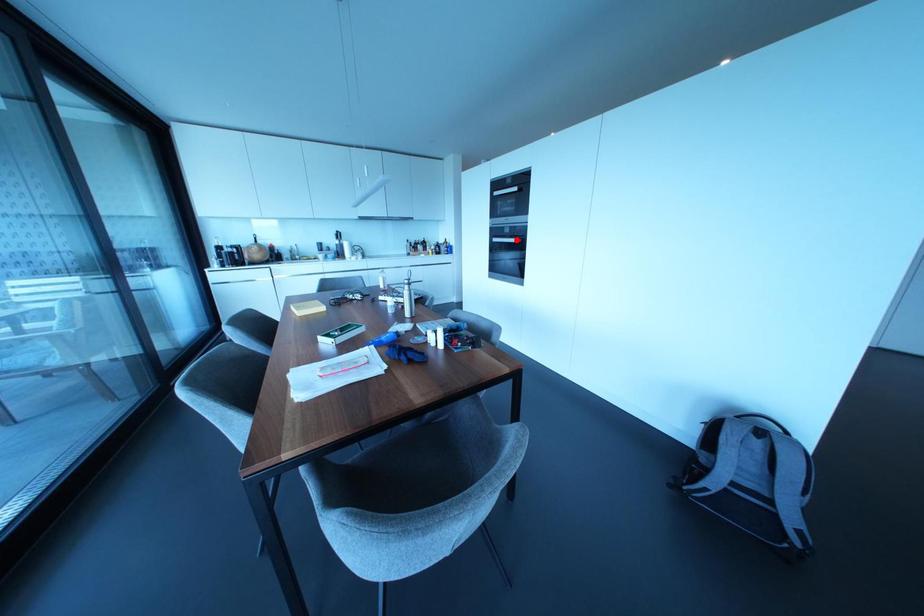
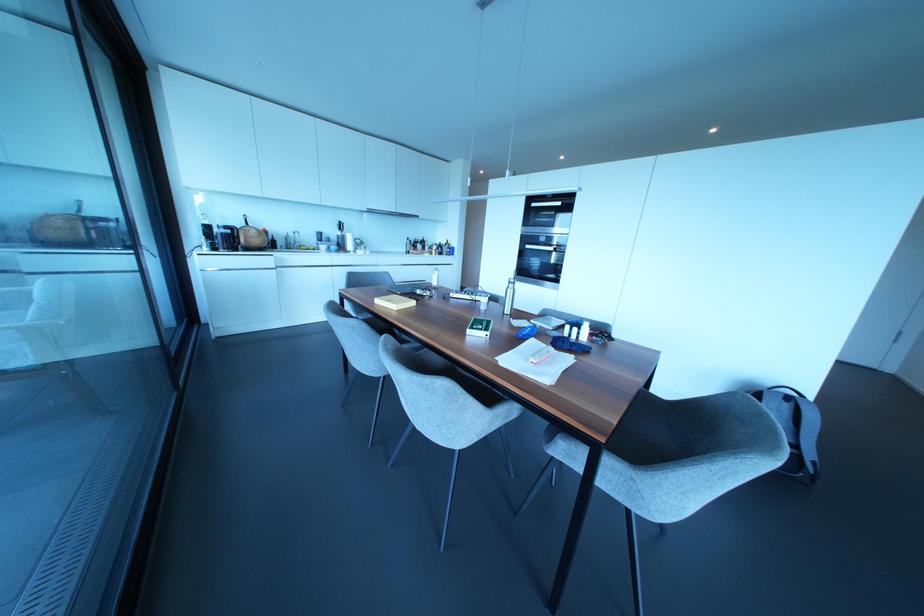
Question: I am providing you with two images of the same scene from different viewpoints. Given a red point in image1, look at the same physical point in image2. Is it:

Choices:
 (A) Closer to the viewpoint
 (B) Farther from the viewpoint

Answer: (A)